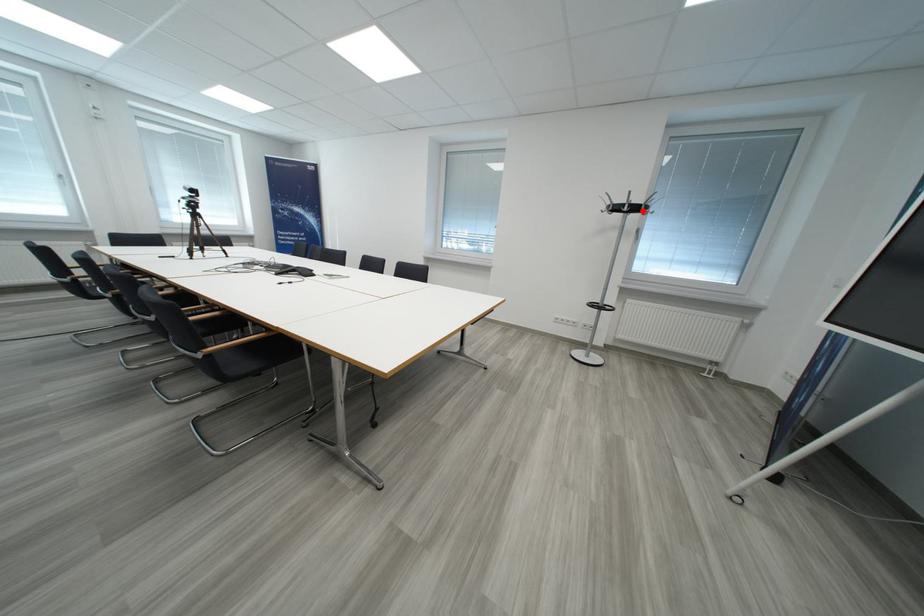
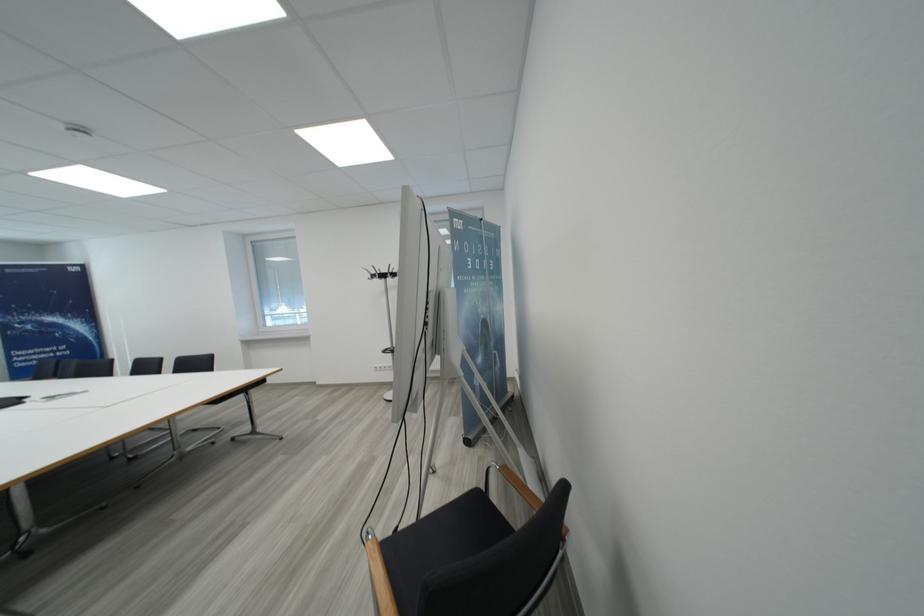
Question: I am providing you with two images of the same scene from different viewpoints. Image1 has a red point marked. In image2, the corresponding 3D location appears at what relative position? Reply with the corresponding letter.

Choices:
 (A) Closer
 (B) Farther

Answer: (B)